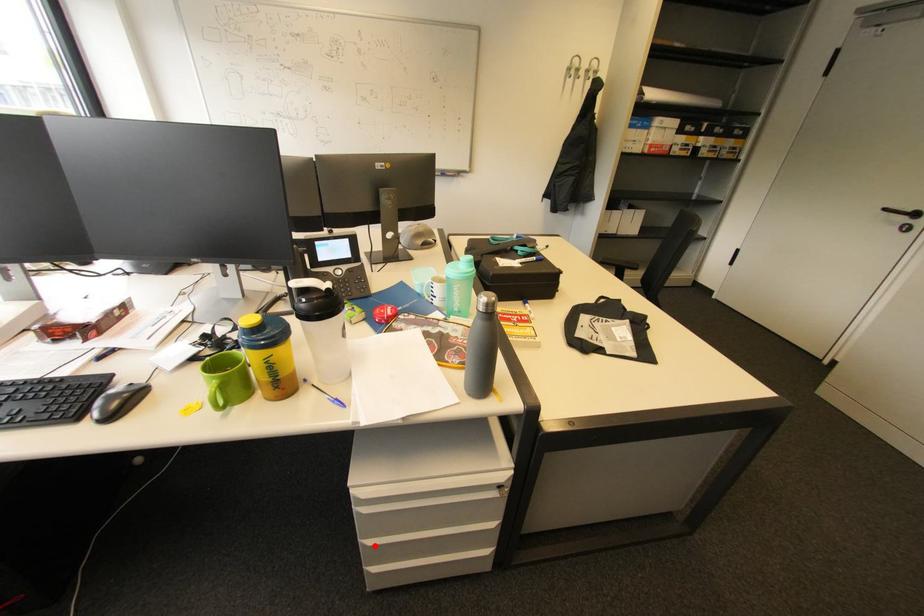
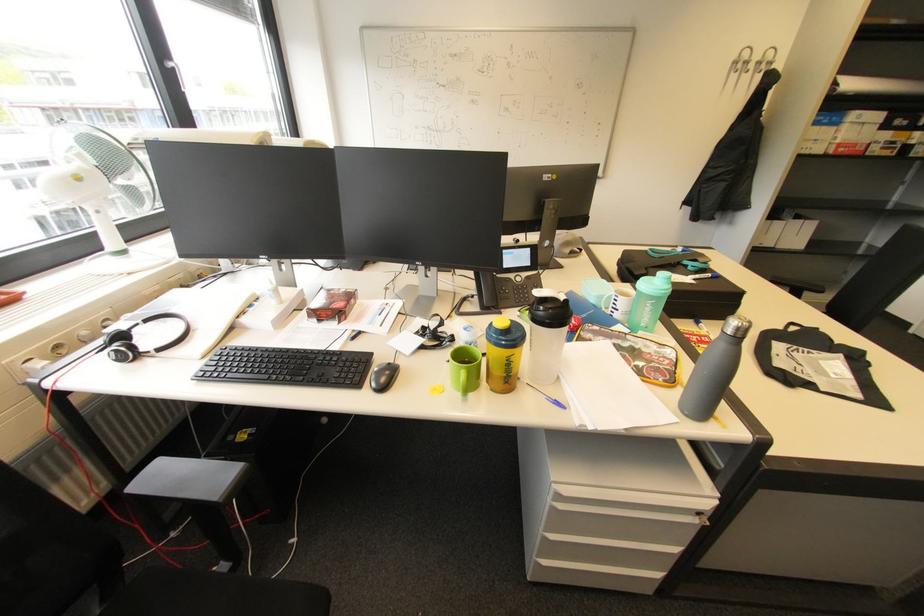
Question: I am providing you with two images of the same scene from different viewpoints. Image1 has a red point marked. In image2, the corresponding 3D location appears at what relative position? Reply with the corresponding letter.

Choices:
 (A) Closer
 (B) Farther

Answer: (B)